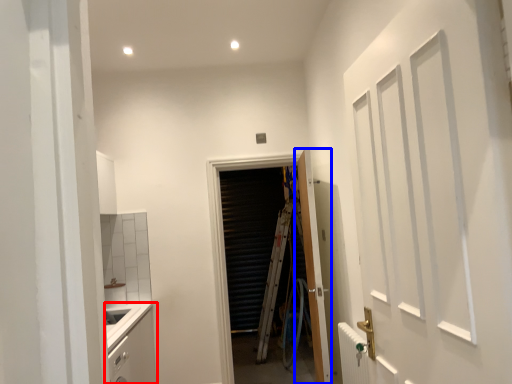
Question: Which of the following is the closest to the observer, cabinetry (highlighted by a red box) or door (highlighted by a blue box)?

Choices:
 (A) cabinetry
 (B) door

Answer: (A)